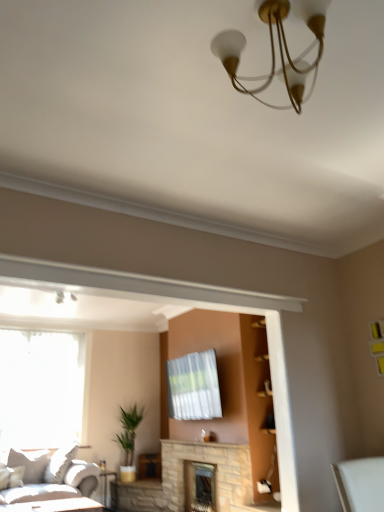
Question: Looking at their shapes, would you say matte gold chandelier at upper center is wider or thinner than white glossy table at lower left?

Choices:
 (A) wide
 (B) thin

Answer: (B)

Question: Is matte gold chandelier at upper center spatially inside white glossy table at lower left, or outside of it?

Choices:
 (A) inside
 (B) outside

Answer: (B)

Question: Estimate the real-world distances between objects in this image. Which object is closer to the green leafy plant at center?

Choices:
 (A) white glossy table at lower left
 (B) light gray fabric couch at lower left
 (C) stone fireplace at center, which ranks as the 1th fireplace in back-to-front order
 (D) white sheer curtain at left
 (E) stone fireplace at center, which is the 1th fireplace from front to back

Answer: (B)

Question: Which is nearer to the white sheer curtain at left?

Choices:
 (A) green leafy plant at center
 (B) stone fireplace at center, which ranks as the 1th fireplace in back-to-front order
 (C) light gray fabric couch at lower left
 (D) white glossy table at lower left
 (E) stone fireplace at center, which ranks as the second fireplace in back-to-front order

Answer: (C)